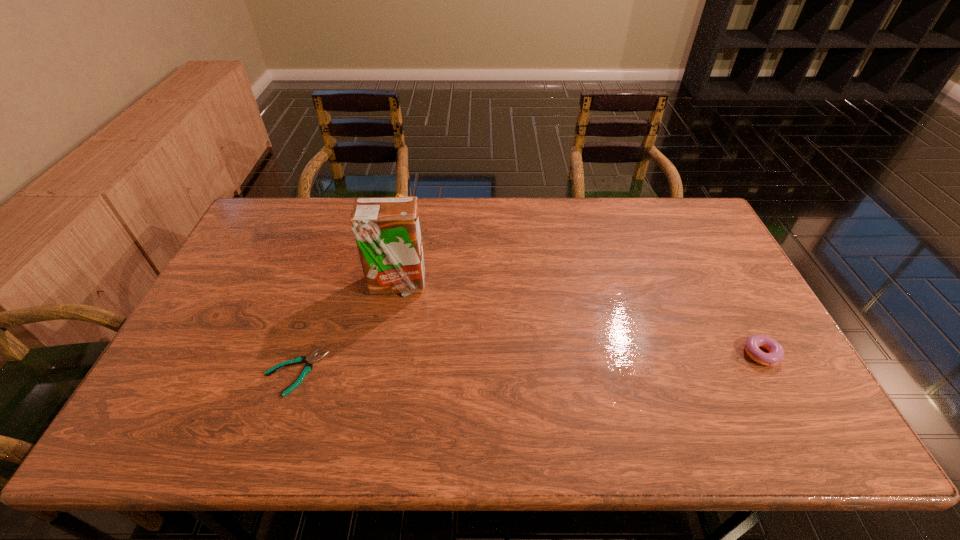
Where is `the leftmost object`? This screenshot has height=540, width=960. the leftmost object is located at coordinates (308, 367).

I want to click on the shortest object, so click(x=308, y=367).

Identify the location of doughnut. (776, 352).

The width and height of the screenshot is (960, 540). Identify the location of the rightmost object. (776, 352).

You are a GUI agent. You are given a task and a screenshot of the screen. Output one action in this format:
    pyautogui.click(x=<x>, y=<y>)
    Task: Click on the farthest object
    This screenshot has width=960, height=540.
    Given the screenshot: What is the action you would take?
    pyautogui.click(x=398, y=195)

Locate an element on the screen. The width and height of the screenshot is (960, 540). Lego is located at coordinates (398, 195).

Image resolution: width=960 pixels, height=540 pixels. I want to click on the tallest object, so click(x=387, y=231).

This screenshot has height=540, width=960. Identify the location of the third nearest object. (387, 231).

Find the location of a particular element. This screenshot has width=960, height=540. free region located on the left of the shortest object is located at coordinates (172, 372).

Locate an element on the screen. The height and width of the screenshot is (540, 960). vacant space located 0.130m on the left of the third tallest object is located at coordinates (695, 356).